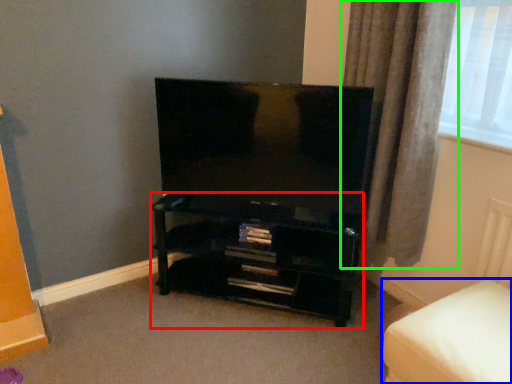
Question: Which object is positioned farthest from shelf (highlighted by a red box)? Select from furniture (highlighted by a blue box) and curtain (highlighted by a green box).

Choices:
 (A) furniture
 (B) curtain

Answer: (A)